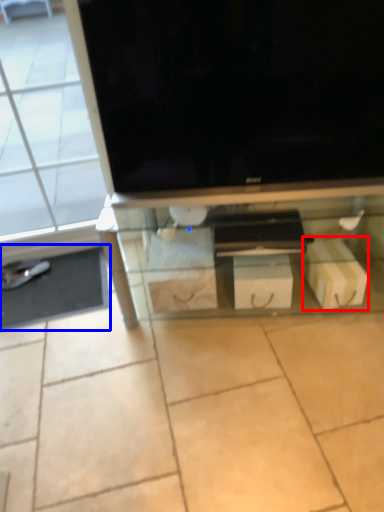
Question: Which object is closer to the camera taking this photo, cardboard box (highlighted by a red box) or flat (highlighted by a blue box)?

Choices:
 (A) cardboard box
 (B) flat

Answer: (A)